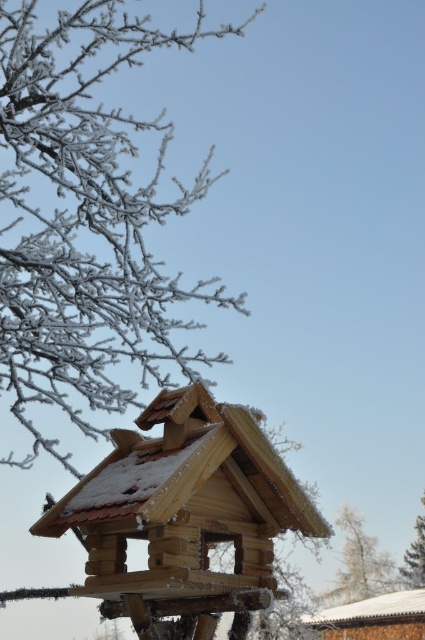
You are standing in the winter scene and want to reach the point at coordinates point (257, 461). If your arm can extend 2 meters, can you reach it?

The point (257, 461) is 2.62 meters from the camera. Since your arm can only extend 2 meters, you cannot reach it.

You are standing at the center of the image and want to walk towards the wooden hut at lower right. In which direction should you move?

Since the wooden hut at lower right is located at coordinates 0.966 on the x and y axis, you should move towards the lower right direction to reach it.